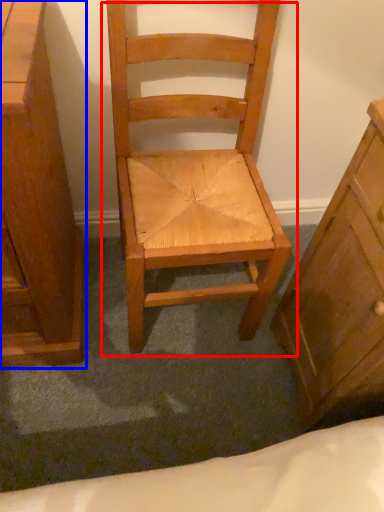
Question: Which object is closer to the camera taking this photo, chair (highlighted by a red box) or chest of drawers (highlighted by a blue box)?

Choices:
 (A) chair
 (B) chest of drawers

Answer: (B)